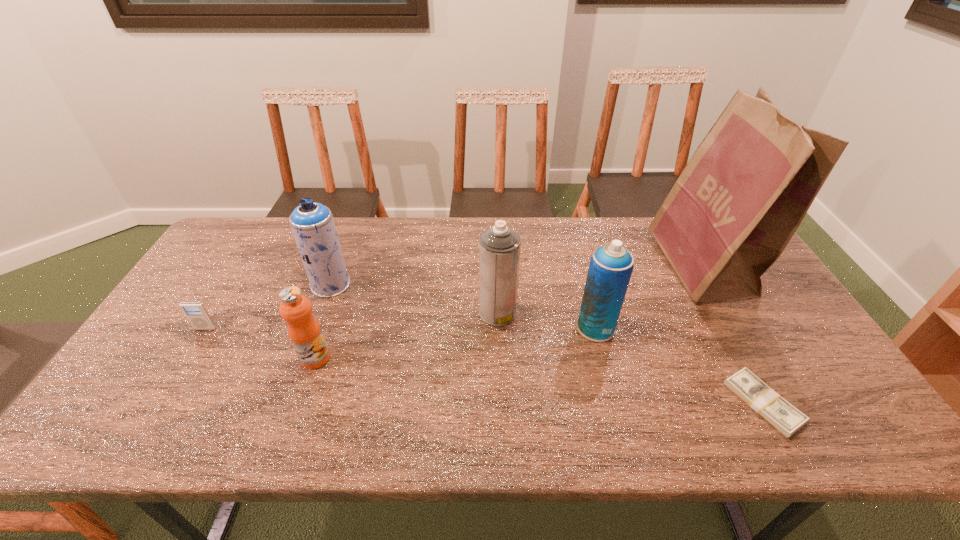
This screenshot has width=960, height=540. In order to click on free spot located 0.230m on the front-facing side of the grocery bag in this screenshot , I will do `click(588, 266)`.

You are a GUI agent. You are given a task and a screenshot of the screen. Output one action in this format:
    pyautogui.click(x=<x>, y=<y>)
    Task: Click on the vacant region located on the front-facing side of the grocery bag
    The width and height of the screenshot is (960, 540).
    Given the screenshot: What is the action you would take?
    pyautogui.click(x=538, y=266)

Find the location of a particular element. The width and height of the screenshot is (960, 540). vacant position located 0.230m on the front-facing side of the grocery bag is located at coordinates (588, 266).

Locate an element on the screen. This screenshot has width=960, height=540. vacant point located on the right of the fourth object from left to right is located at coordinates (562, 313).

Find the location of a particular element. The width and height of the screenshot is (960, 540). free region located on the back of the farthest aerosol can is located at coordinates (342, 256).

Find the location of `free space located 0.270m on the left of the third object from right to left`. free space located 0.270m on the left of the third object from right to left is located at coordinates (477, 327).

At what (x,y) coordinates should I click in order to perform the action: click on vacant space located 0.070m on the right of the fruit juice. Please return your answer as a coordinate pair (x, y). The height and width of the screenshot is (540, 960). Looking at the image, I should click on (357, 359).

I want to click on free space located on the front-facing side of the sixth tallest object, so click(x=165, y=394).

Where is `vacant area situated 0.210m on the left of the nearest object`? This screenshot has height=540, width=960. vacant area situated 0.210m on the left of the nearest object is located at coordinates (642, 402).

Where is `object that is at the far edge`? object that is at the far edge is located at coordinates (746, 189).